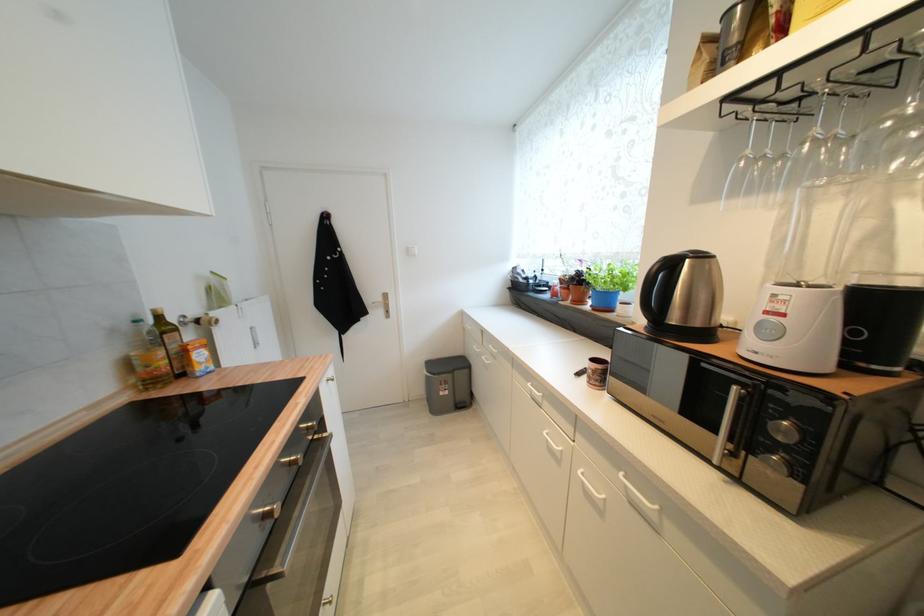
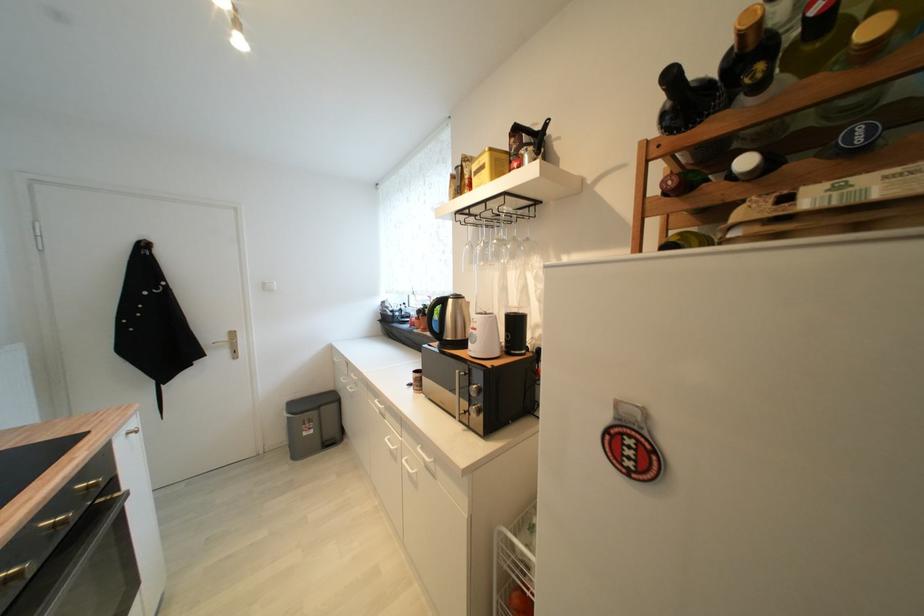
In the second image, find the point that corresponds to (885,310) in the first image.

(521, 325)